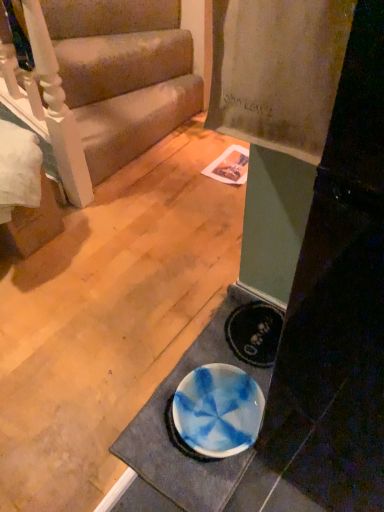
Question: Is white glossy doormat at lower center inside or outside of beige fabric couch at upper left?

Choices:
 (A) outside
 (B) inside

Answer: (A)

Question: From their relative heights in the image, would you say white glossy doormat at lower center is taller or shorter than beige fabric couch at upper left?

Choices:
 (A) short
 (B) tall

Answer: (A)

Question: From the image's perspective, is white glossy doormat at lower center above or below beige fabric couch at upper left?

Choices:
 (A) below
 (B) above

Answer: (A)

Question: From a real-world perspective, is beige fabric couch at upper left positioned above or below white glossy doormat at lower center?

Choices:
 (A) below
 (B) above

Answer: (B)

Question: Is point (91, 57) closer or farther from the camera than point (132, 428)?

Choices:
 (A) farther
 (B) closer

Answer: (A)

Question: In terms of width, does beige fabric couch at upper left look wider or thinner when compared to white glossy doormat at lower center?

Choices:
 (A) thin
 (B) wide

Answer: (B)

Question: From the image's perspective, is beige fabric couch at upper left positioned above or below white glossy doormat at lower center?

Choices:
 (A) above
 (B) below

Answer: (A)